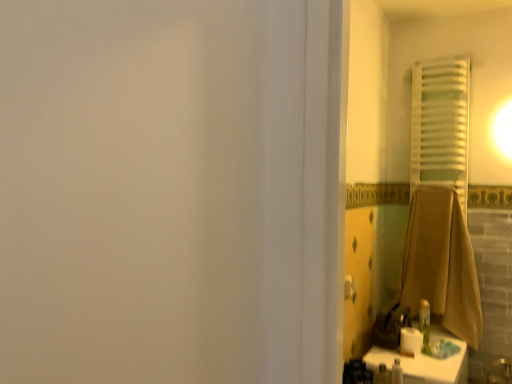
You are a GUI agent. You are given a task and a screenshot of the screen. Output one action in this format:
    pyautogui.click(x=<x>, y=<y>)
    Task: Click on the vacant area that is in front of white matte toilet paper at lower right
    
    Given the screenshot: What is the action you would take?
    pyautogui.click(x=425, y=367)